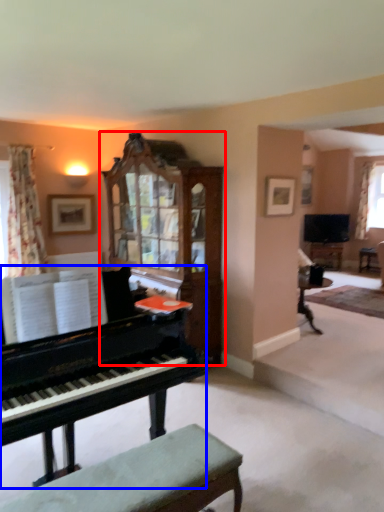
Question: Which object is closer to the camera taking this photo, cabinetry (highlighted by a red box) or piano (highlighted by a blue box)?

Choices:
 (A) cabinetry
 (B) piano

Answer: (B)